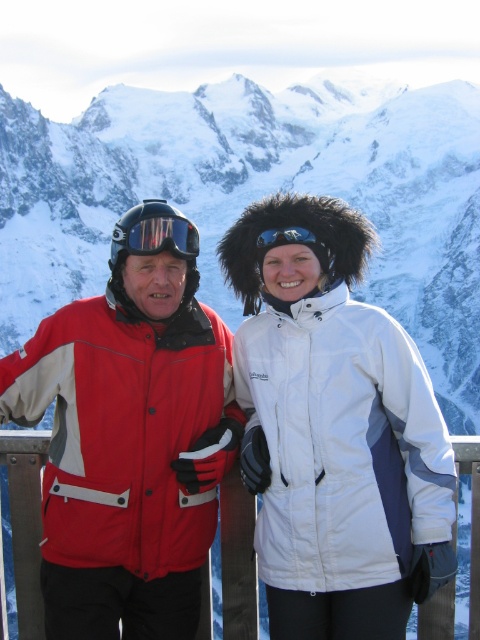
Based on the scene description, where is the point at coordinates (256, 196) located?

The point at coordinates (256, 196) corresponds to the snowy mountain at center.